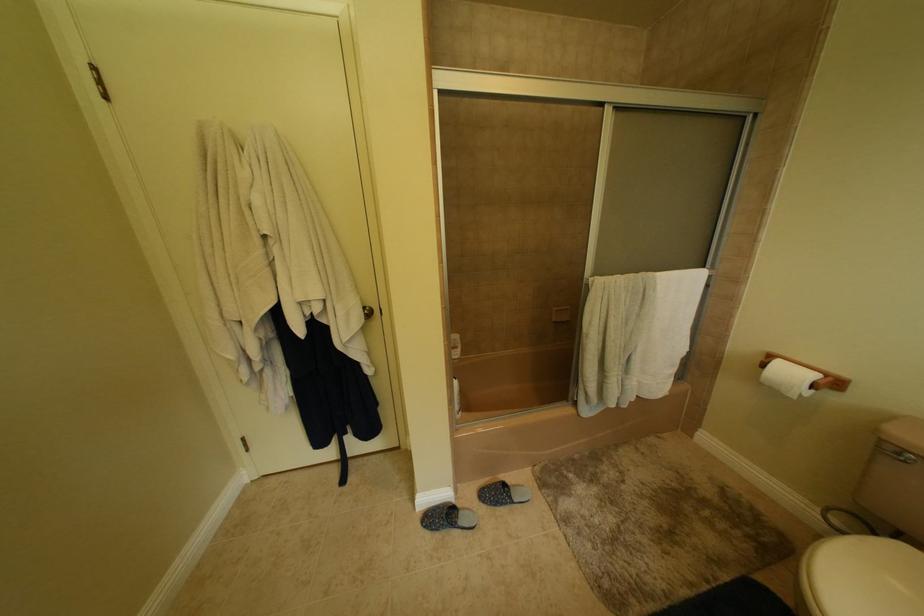
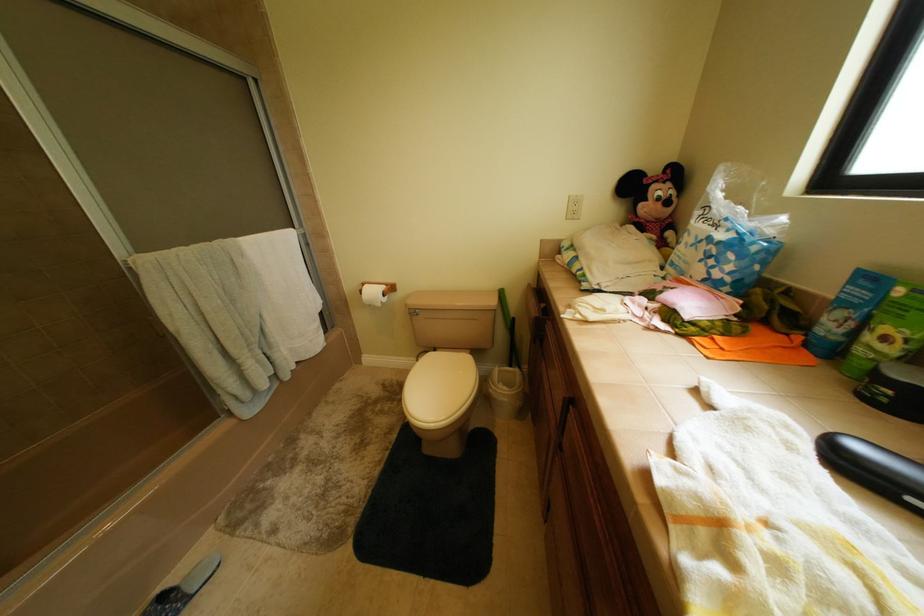
How did the camera likely rotate?

The camera's rotation is toward right-down.